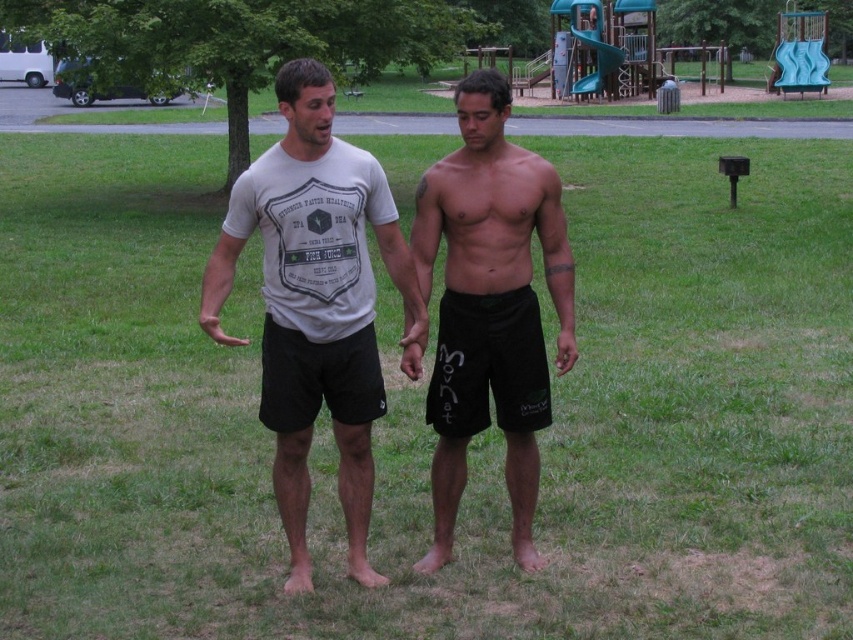
Which of these two, white cotton t-shirt at center or black matte shorts at center, stands shorter?

With less height is black matte shorts at center.

Is point (341, 269) in front of point (444, 536)?

Yes, point (341, 269) is in front of point (444, 536).

This screenshot has height=640, width=853. In order to click on white cotton t-shirt at center in this screenshot , I will do `click(316, 304)`.